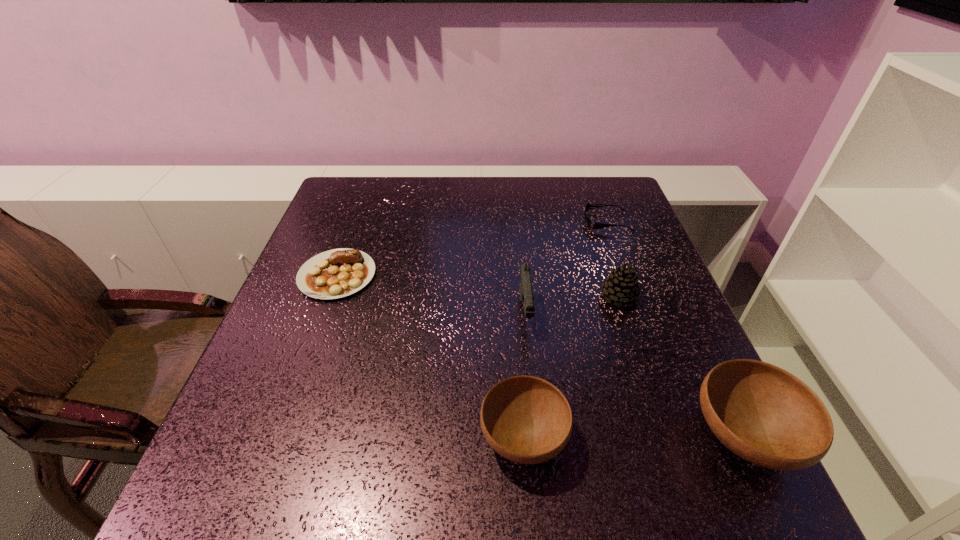
The height and width of the screenshot is (540, 960). Find the location of `free space at the near left corner of the desktop`. free space at the near left corner of the desktop is located at coordinates (240, 423).

In order to click on blank area at the far right corner in this screenshot , I will do `click(622, 198)`.

This screenshot has height=540, width=960. What are the coordinates of `free area in between the sunglasses and the leftmost object` in the screenshot? It's located at (472, 248).

Identify the location of empty space between the pistol and the steak. (431, 294).

Identify the location of unoccupied area between the fifth tallest object and the left bowl. The width and height of the screenshot is (960, 540). (430, 356).

At what (x,y) coordinates should I click in order to perform the action: click on vacant area that lies between the taller bowl and the pistol. Please return your answer as a coordinate pair (x, y). Looking at the image, I should click on (635, 375).

At what (x,y) coordinates should I click in order to perform the action: click on vacant space that's between the fourth tallest object and the steak. Please return your answer as a coordinate pair (x, y). This screenshot has width=960, height=540. Looking at the image, I should click on (430, 356).

Locate an element on the screen. The height and width of the screenshot is (540, 960). unoccupied area between the pistol and the leftmost object is located at coordinates (431, 294).

Find the location of a particular element. This screenshot has width=960, height=540. vacant space in between the sunglasses and the pinecone is located at coordinates (613, 259).

Where is `free space between the shortest object and the steak`? free space between the shortest object and the steak is located at coordinates (472, 248).